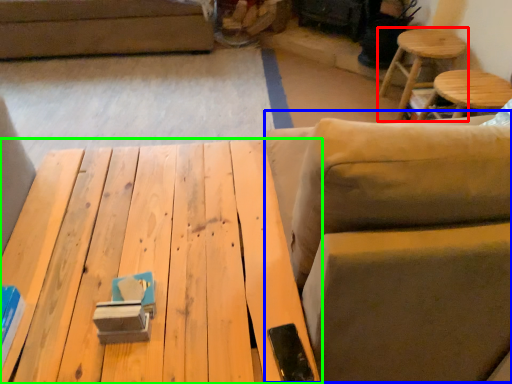
Question: Estimate the real-world distances between objects in this image. Which object is closer to stool (highlighted by a red box), swivel chair (highlighted by a blue box) or table (highlighted by a green box)?

Choices:
 (A) swivel chair
 (B) table

Answer: (A)